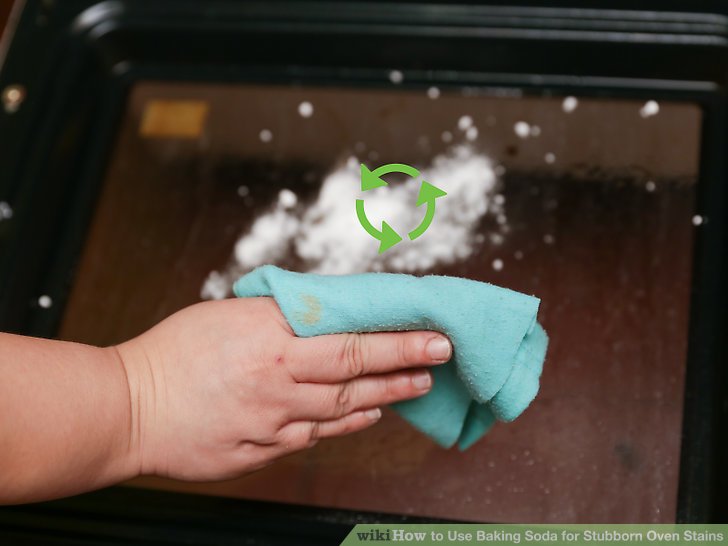
I want to click on rag, so click(421, 302).